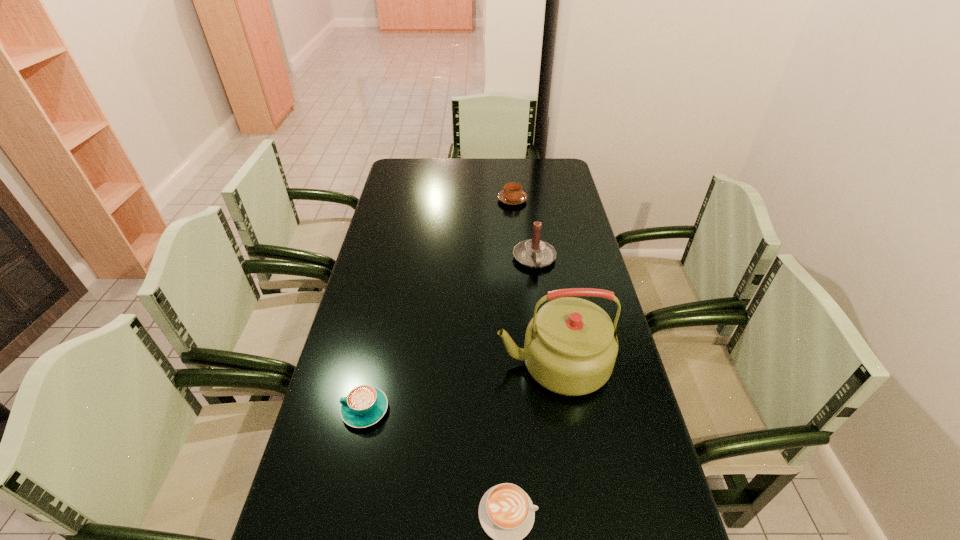
You are a GUI agent. You are given a task and a screenshot of the screen. Output one action in this format:
    pyautogui.click(x=<x>, y=<y>)
    Task: Click on the vacant region located 0.270m on the side of the farthest object with the handle
    This screenshot has height=540, width=960.
    Given the screenshot: What is the action you would take?
    pyautogui.click(x=509, y=162)

I want to click on free spot located on the side of the farthest object with the handle, so click(511, 183).

Find the location of a particular element. This screenshot has width=960, height=540. free space located on the side of the farthest object with the handle is located at coordinates (511, 184).

Where is `object at the left edge`? The width and height of the screenshot is (960, 540). object at the left edge is located at coordinates (365, 405).

What are the coordinates of `kettle that is positioned at the right edge` in the screenshot? It's located at tap(570, 348).

Locate an element on the screen. candle situated at the right edge is located at coordinates (534, 253).

At what (x,y) coordinates should I click in order to perform the action: click on vacant space at the left edge of the desktop. Please return your answer as a coordinate pair (x, y). The height and width of the screenshot is (540, 960). Looking at the image, I should click on (336, 363).

Where is `blank space at the right edge of the desktop`? This screenshot has width=960, height=540. blank space at the right edge of the desktop is located at coordinates (619, 418).

This screenshot has height=540, width=960. I want to click on vacant space at the far right corner of the desktop, so click(x=546, y=164).

Locate an element on the screen. free space that is in between the leftmost cappuccino and the second tallest object is located at coordinates (450, 334).